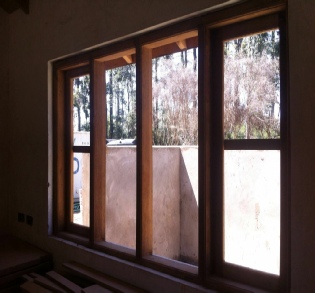
The width and height of the screenshot is (315, 293). Find the location of `electrical outlet`. electrical outlet is located at coordinates (21, 220), (27, 219).